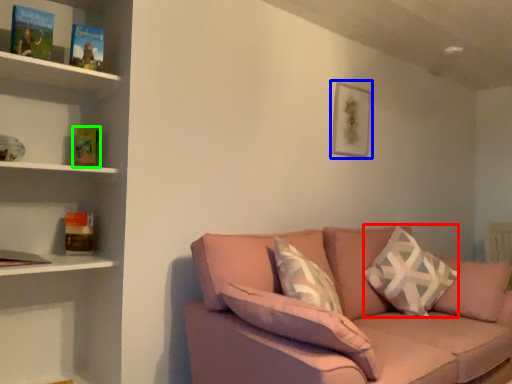
Question: Which object is positioned farthest from throw pillow (highlighted by a red box)? Select from picture frame (highlighted by a blue box) and paperback book (highlighted by a green box).

Choices:
 (A) picture frame
 (B) paperback book

Answer: (B)